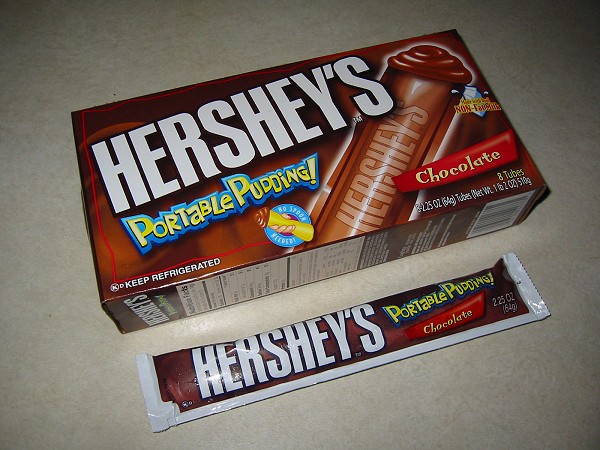
Where is `table`? table is located at coordinates (46, 110).